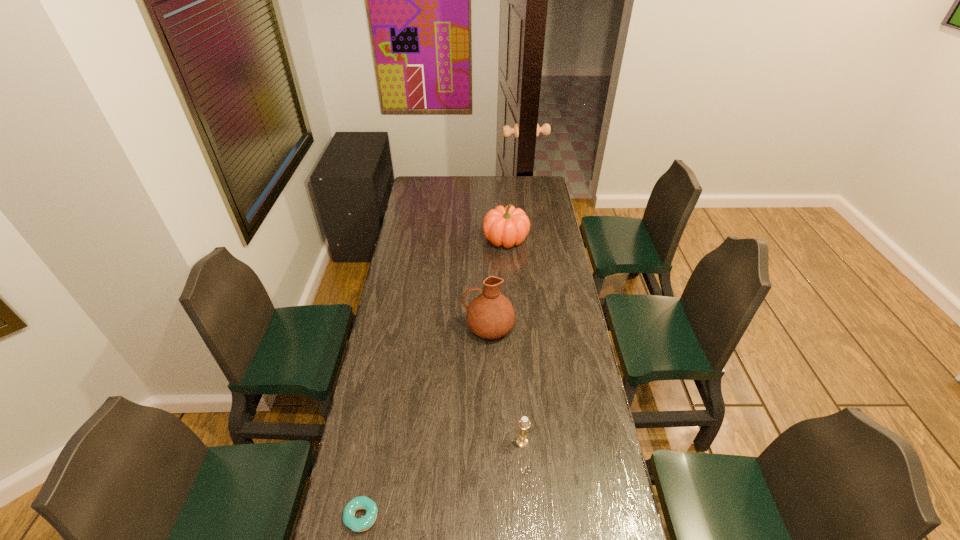
Locate an element on the screen. The image size is (960, 540). pitcher is located at coordinates (490, 315).

Locate an element on the screen. the tallest object is located at coordinates 490,315.

Find the location of a particular element. pumpkin is located at coordinates (508, 226).

Where is `the third shortest object`? This screenshot has width=960, height=540. the third shortest object is located at coordinates (508, 226).

This screenshot has width=960, height=540. In order to click on the second nearest object in this screenshot , I will do `click(524, 424)`.

Identify the location of the second shortest object. click(524, 424).

Find the location of `the leftmost object`. the leftmost object is located at coordinates (362, 524).

Locate an element on the screen. the shortest object is located at coordinates (362, 524).

In order to click on free space located 0.260m on the side of the tallest object with the handle in this screenshot , I will do `click(400, 327)`.

I want to click on vacant region located 0.050m on the side of the tallest object with the handle, so click(x=451, y=327).